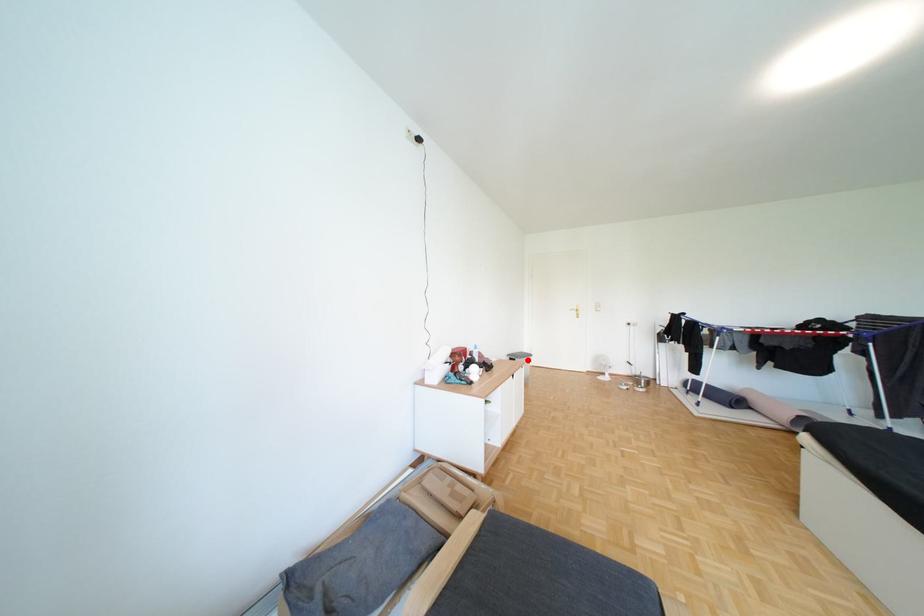
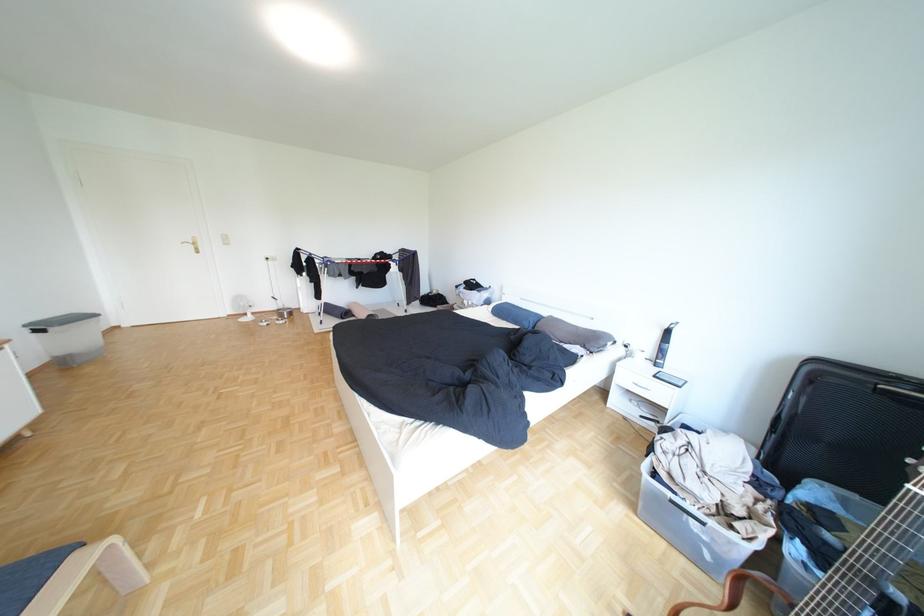
Where in the second image is the point corresponding to the highlighted location from the first image?

(55, 331)